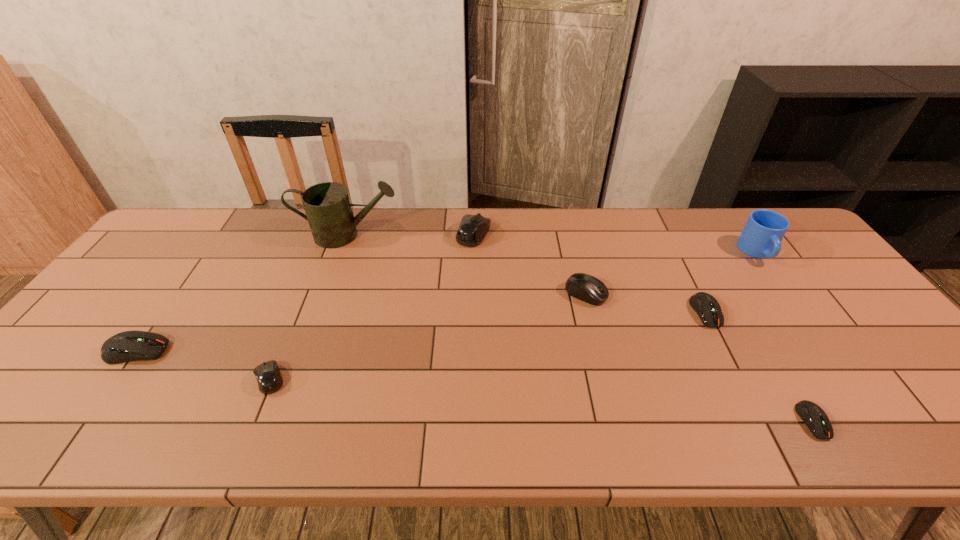
Select which black mouse is the closest to the second smallest black mouse. Please provide its 2D coordinates. Your answer should be formatted as a tuple, i.e. [(x, y)], where the tuple contains the x and y coordinates of a point satisfying the conditions above.

[(473, 228)]

Select which black mouse is the third closest to the second dark computer equipment from left to right. Please provide its 2D coordinates. Your answer should be formatted as a tuple, i.e. [(x, y)], where the tuple contains the x and y coordinates of a point satisfying the conditions above.

[(269, 379)]

The height and width of the screenshot is (540, 960). What are the coordinates of `dark computer equipment that is the second closest one to the second dark computer equipment from right to left` in the screenshot? It's located at (127, 346).

Identify which dark computer equipment is located as the second nearest to the rightmost black mouse. Please provide its 2D coordinates. Your answer should be formatted as a tuple, i.e. [(x, y)], where the tuple contains the x and y coordinates of a point satisfying the conditions above.

[(815, 418)]

The height and width of the screenshot is (540, 960). Find the location of `free space that satisfies the following two spatial constraints: 1. on the button of the second computer equipment from right to left; 2. on the button of the leftmost dark computer equipment`. free space that satisfies the following two spatial constraints: 1. on the button of the second computer equipment from right to left; 2. on the button of the leftmost dark computer equipment is located at coordinates (725, 351).

You are a GUI agent. You are given a task and a screenshot of the screen. Output one action in this format:
    pyautogui.click(x=<x>, y=<y>)
    Task: Click on the free spot that satisfies the following two spatial constraints: 1. on the back side of the second farthest black mouse; 2. with the spout on the tallest object
    Image resolution: width=960 pixels, height=540 pixels.
    Given the screenshot: What is the action you would take?
    pyautogui.click(x=571, y=235)